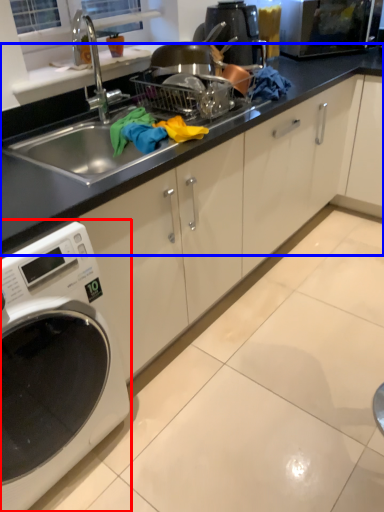
Question: Which point is closer to the camera, home appliance (highlighted by a red box) or countertop (highlighted by a blue box)?

Choices:
 (A) home appliance
 (B) countertop

Answer: (A)